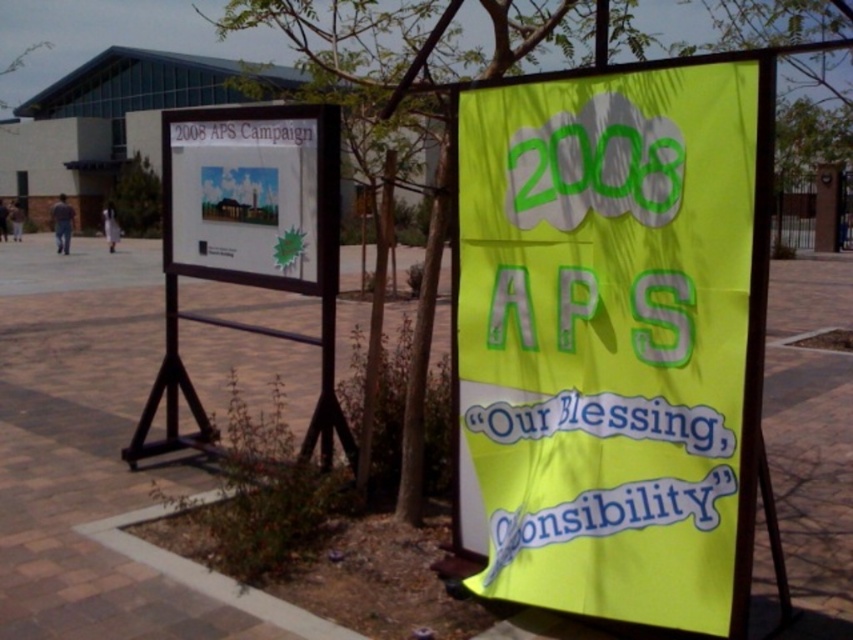
Who is shorter, yellow fabric banner at center or white paper poster at upper left?

white paper poster at upper left is shorter.

Is yellow fabric banner at center to the right of white paper poster at upper left from the viewer's perspective?

Yes, yellow fabric banner at center is to the right of white paper poster at upper left.

Is point (833, 605) behind point (251, 264)?

No, it is in front of (251, 264).

At what (x,y) coordinates should I click in order to perform the action: click on yellow fabric banner at center. Please return your answer as a coordinate pair (x, y). This screenshot has height=640, width=853. Looking at the image, I should click on (85, 448).

Which is in front, point (294, 403) or point (363, 81)?

Point (363, 81)

Looking at this image, does yellow fabric banner at center have a greater width compared to green leafy tree at center?

Correct, the width of yellow fabric banner at center exceeds that of green leafy tree at center.

This screenshot has width=853, height=640. What do you see at coordinates (85, 448) in the screenshot?
I see `yellow fabric banner at center` at bounding box center [85, 448].

Identify the location of yellow fabric banner at center. Image resolution: width=853 pixels, height=640 pixels. (85, 448).

Which of these two, yellow paper at center or white paper poster at upper left, stands taller?

With more height is yellow paper at center.

Does point (747, 396) come behind point (294, 243)?

No, it is not.

Where is `yellow paper at center`? This screenshot has height=640, width=853. yellow paper at center is located at coordinates pyautogui.click(x=613, y=339).

Where is `yellow paper at center`? The width and height of the screenshot is (853, 640). yellow paper at center is located at coordinates (613, 339).